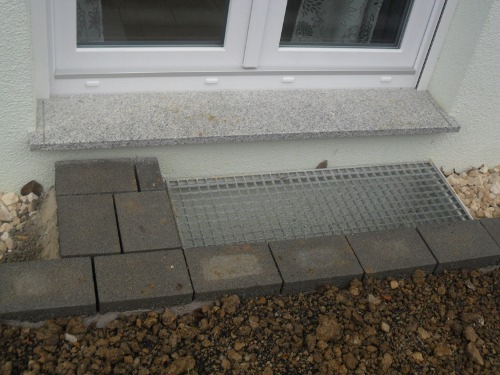
Where is `right window`? right window is located at coordinates (356, 32).